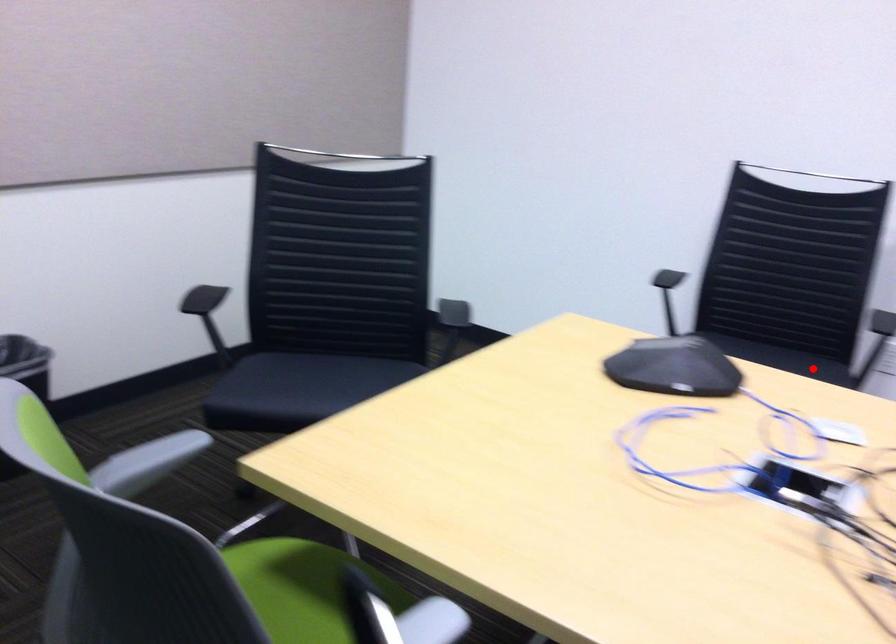
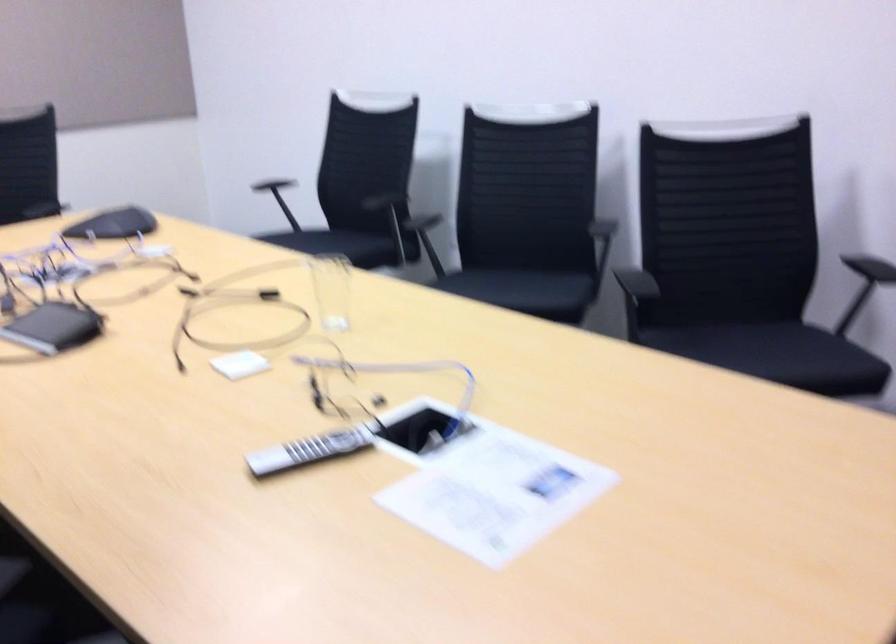
Where in the second image is the point corresponding to the highlighted location from the first image?

(350, 245)